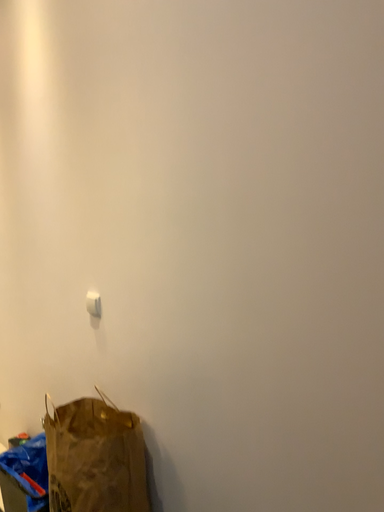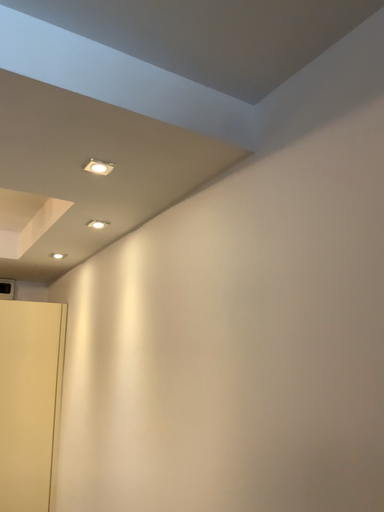
Question: How did the camera likely rotate when shooting the video?

Choices:
 (A) rotated left
 (B) rotated right

Answer: (A)